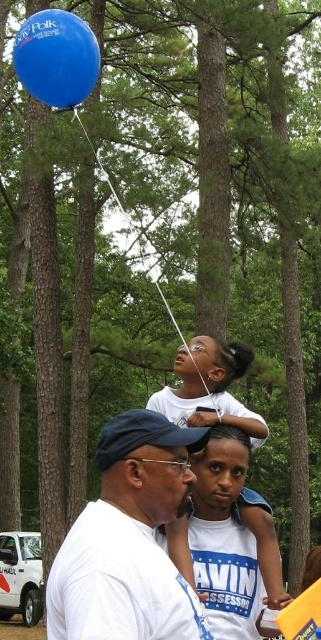
Question: Which of the following is the closest to the observer?

Choices:
 (A) blue rubber balloon at upper center
 (B) white matte shirt at center
 (C) blue cotton shirt at center
 (D) blue rubber balloon at upper left

Answer: (B)

Question: Which point is closer to the camera taking this photo?

Choices:
 (A) tap(44, 56)
 (B) tap(103, 600)

Answer: (B)

Question: Which object is the closest to the blue cotton shirt at center?

Choices:
 (A) white matte shirt at center
 (B) blue rubber balloon at upper left
 (C) blue rubber balloon at upper center

Answer: (A)

Question: Is blue cotton shirt at center behind blue rubber balloon at upper left?

Choices:
 (A) no
 (B) yes

Answer: (A)

Question: Does white matte shirt at center have a larger size compared to blue cotton shirt at center?

Choices:
 (A) no
 (B) yes

Answer: (A)

Question: Can you confirm if blue rubber balloon at upper left is positioned below blue rubber balloon at upper center?

Choices:
 (A) no
 (B) yes

Answer: (A)